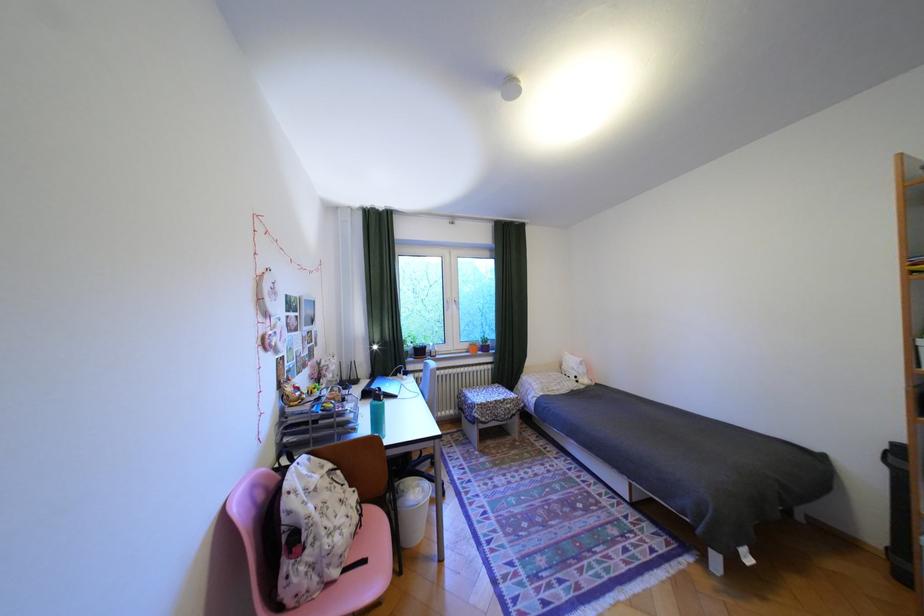
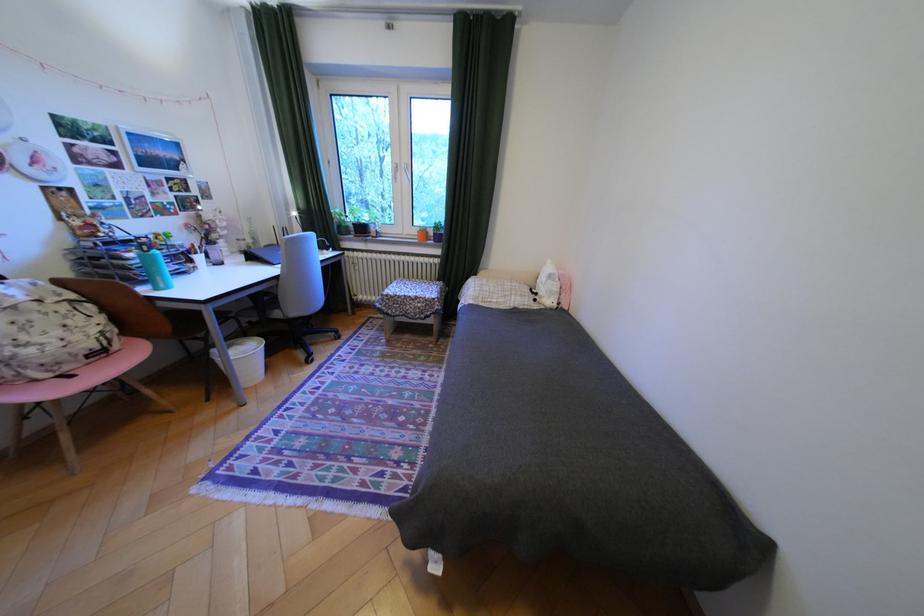
Where in the second image is the point corresponding to (x=478, y=346) from the first image?

(427, 232)